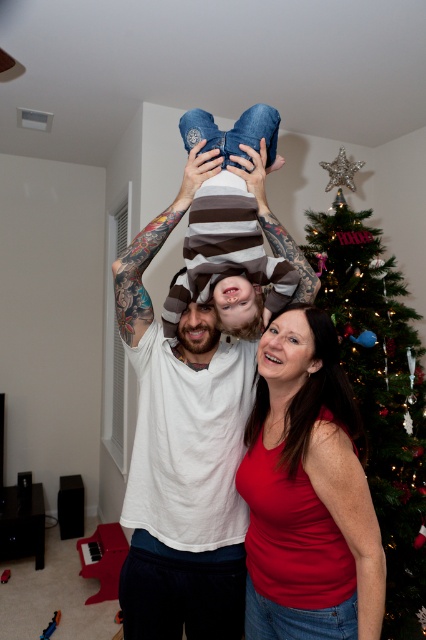
You are a photographer trying to capture a group photo of the family. You notice the white matte shirt at center and the green glittery christmas tree at upper right in the frame. Which object takes up more space in the photo?

The green glittery christmas tree at upper right takes up more space in the photo because the white matte shirt at center has a smaller width compared to the green glittery christmas tree at upper right.

You are a photographer setting up a camera at the same level as the child in the image. You want to capture both the white matte shirt at center and the denim jeans at center in the frame. Which part of the child will appear higher in the photo?

The white matte shirt at center appears higher in the photo because it is much taller than the denim jeans at center.